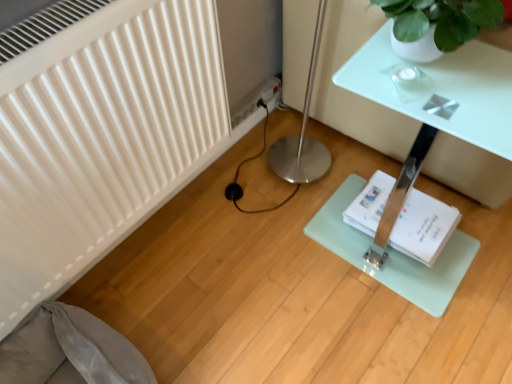
Locate an element on the screen. vacant space situated above white paper book at center (from a real-world perspective) is located at coordinates (410, 211).